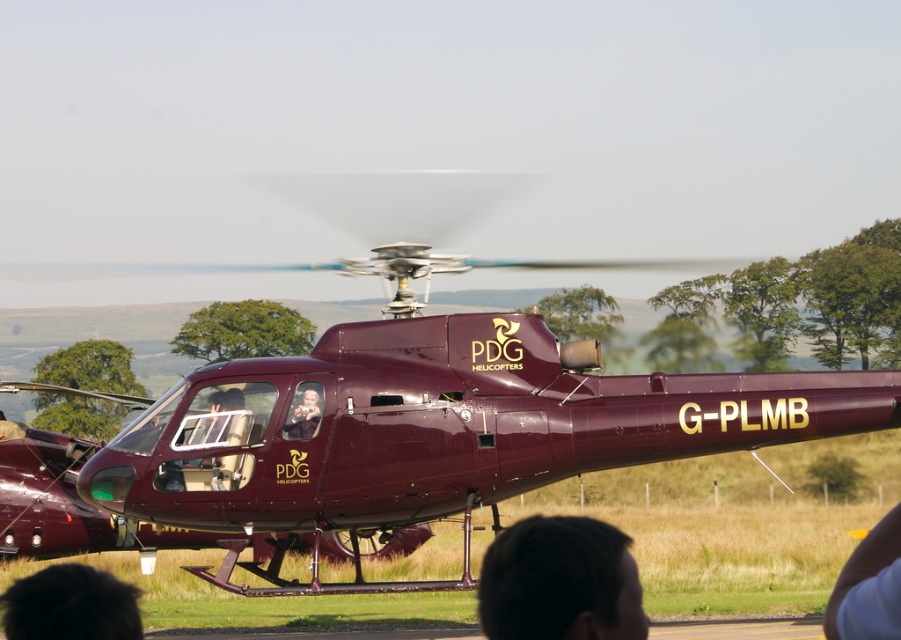
Question: Which point is farther to the camera?

Choices:
 (A) (58, 611)
 (B) (494, 605)

Answer: (A)

Question: Does dark brown hair at lower center have a lesser width compared to smooth plastic baby at center?

Choices:
 (A) yes
 (B) no

Answer: (B)

Question: Does maroon glossy helicopter at center appear on the right side of dark hair at lower left?

Choices:
 (A) yes
 (B) no

Answer: (A)

Question: Does maroon glossy helicopter at center have a smaller size compared to smooth plastic baby at center?

Choices:
 (A) no
 (B) yes

Answer: (A)

Question: Which of the following is the farthest from the observer?

Choices:
 (A) (385, 518)
 (B) (628, 584)

Answer: (A)

Question: Which point is closer to the camera?

Choices:
 (A) dark hair at lower left
 (B) smooth plastic baby at center

Answer: (A)